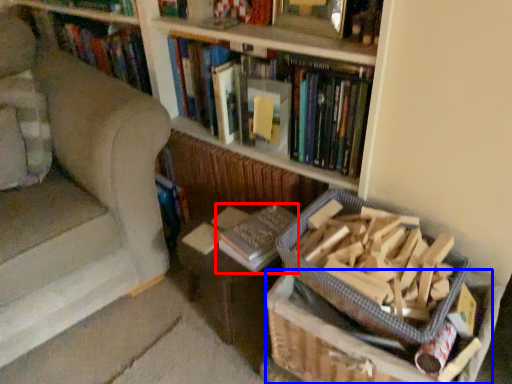
Question: Which point is closer to the camera, book (highlighted by a red box) or cardboard box (highlighted by a blue box)?

Choices:
 (A) book
 (B) cardboard box

Answer: (B)